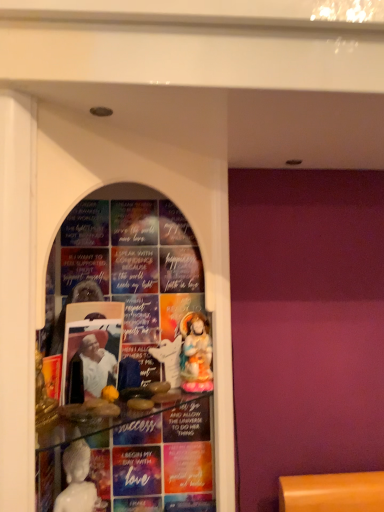
Question: Which direction should I rotate to face white glossy statue at center, the first person in the front-to-back sequence, — up or down?

Choices:
 (A) up
 (B) down

Answer: (B)

Question: Can we say white glossy statue at center lies outside porcelain statue at center, the second person viewed from the front?

Choices:
 (A) no
 (B) yes

Answer: (B)

Question: Can you confirm if white glossy statue at center is positioned to the right of porcelain statue at center, placed as the 1th person when sorted from right to left?

Choices:
 (A) no
 (B) yes

Answer: (A)

Question: Is white glossy statue at center thinner than porcelain statue at center, the second person viewed from the front?

Choices:
 (A) yes
 (B) no

Answer: (A)

Question: Does white glossy statue at center have a smaller size compared to porcelain statue at center, placed as the 1th person when sorted from right to left?

Choices:
 (A) yes
 (B) no

Answer: (A)

Question: Considering the relative positions of white glossy statue at center and porcelain statue at center, which appears as the 1th person when viewed from the back, in the image provided, is white glossy statue at center to the left of porcelain statue at center, which appears as the 1th person when viewed from the back, from the viewer's perspective?

Choices:
 (A) no
 (B) yes

Answer: (B)

Question: From the image's perspective, is white glossy statue at center beneath porcelain statue at center, the second person positioned from the left?

Choices:
 (A) yes
 (B) no

Answer: (A)

Question: Considering the relative sizes of white glossy statue at center, the second person in the right-to-left sequence, and porcelain statue at center, placed as the 1th person when sorted from right to left, in the image provided, is white glossy statue at center, the second person in the right-to-left sequence, wider than porcelain statue at center, placed as the 1th person when sorted from right to left,?

Choices:
 (A) yes
 (B) no

Answer: (B)

Question: Can you see white glossy statue at center, the second person in the right-to-left sequence, touching porcelain statue at center, placed as the 1th person when sorted from right to left?

Choices:
 (A) yes
 (B) no

Answer: (B)

Question: Can we say white glossy statue at center, the first person in the front-to-back sequence, lies outside porcelain statue at center, which appears as the 1th person when viewed from the back?

Choices:
 (A) yes
 (B) no

Answer: (A)

Question: From the image's perspective, would you say white glossy statue at center, the second person in the right-to-left sequence, is positioned over porcelain statue at center, the second person positioned from the left?

Choices:
 (A) yes
 (B) no

Answer: (A)

Question: Considering the relative positions of white glossy statue at center, the second person in the right-to-left sequence, and porcelain statue at center, the second person positioned from the left, in the image provided, is white glossy statue at center, the second person in the right-to-left sequence, to the right of porcelain statue at center, the second person positioned from the left, from the viewer's perspective?

Choices:
 (A) no
 (B) yes

Answer: (A)

Question: Can you confirm if white glossy statue at center, the second person in the right-to-left sequence, is taller than porcelain statue at center, placed as the 1th person when sorted from right to left?

Choices:
 (A) yes
 (B) no

Answer: (B)

Question: Can you confirm if white glossy statue at center, which is the second person from back to front, is taller than white glossy statue at center?

Choices:
 (A) no
 (B) yes

Answer: (B)